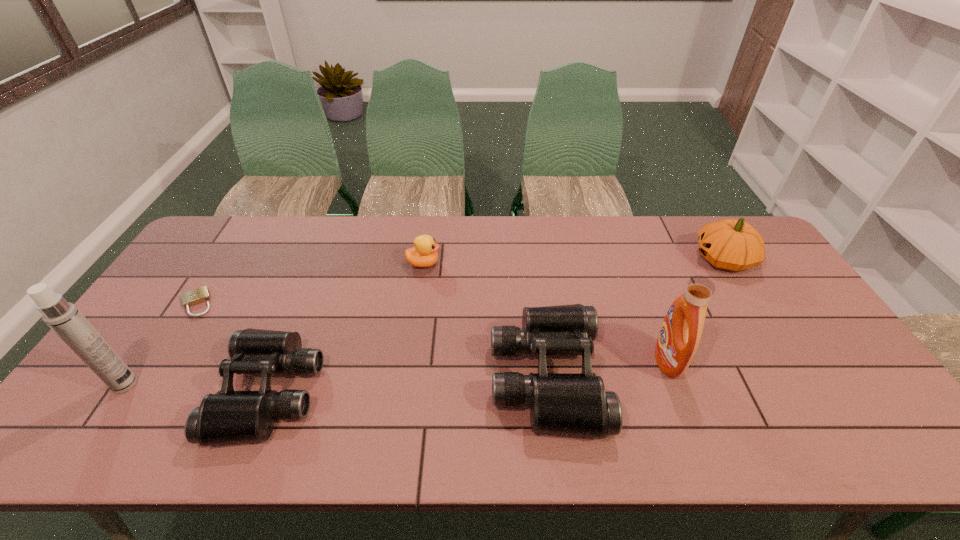
Identify the location of the left binoculars. (228, 416).

You are a GUI agent. You are given a task and a screenshot of the screen. Output one action in this format:
    pyautogui.click(x=<x>, y=<y>)
    Task: Click on the shorter binoculars
    This screenshot has width=960, height=540.
    Given the screenshot: What is the action you would take?
    pyautogui.click(x=228, y=416)

You are a GUI agent. You are given a task and a screenshot of the screen. Output one action in this format:
    pyautogui.click(x=<x>, y=<y>)
    Task: Click on the taller binoculars
    The height and width of the screenshot is (540, 960).
    Given the screenshot: What is the action you would take?
    (x=566, y=403)

Locate an element on the screen. This screenshot has width=960, height=540. the fifth object from left to right is located at coordinates (566, 403).

Locate an element on the screen. the fourth object from left to right is located at coordinates (424, 254).

You are a GUI agent. You are given a task and a screenshot of the screen. Output one action in this format:
    pyautogui.click(x=<x>, y=<y>)
    Task: Click on the shortest object
    The width and height of the screenshot is (960, 540).
    Given the screenshot: What is the action you would take?
    pyautogui.click(x=201, y=294)

Find the location of `the third farthest object`. the third farthest object is located at coordinates (201, 294).

You are a GUI agent. You are given a task and a screenshot of the screen. Output one action in this format:
    pyautogui.click(x=<x>, y=<y>)
    Task: Click on the gourd
    The image size is (960, 540).
    Given the screenshot: What is the action you would take?
    pyautogui.click(x=729, y=244)

At what (x,y) coordinates should I click in order to perform the action: click on detergent. Please return your answer as a coordinate pair (x, y). Looking at the image, I should click on (680, 334).

Locate an element on the screen. the sixth shortest object is located at coordinates (680, 334).